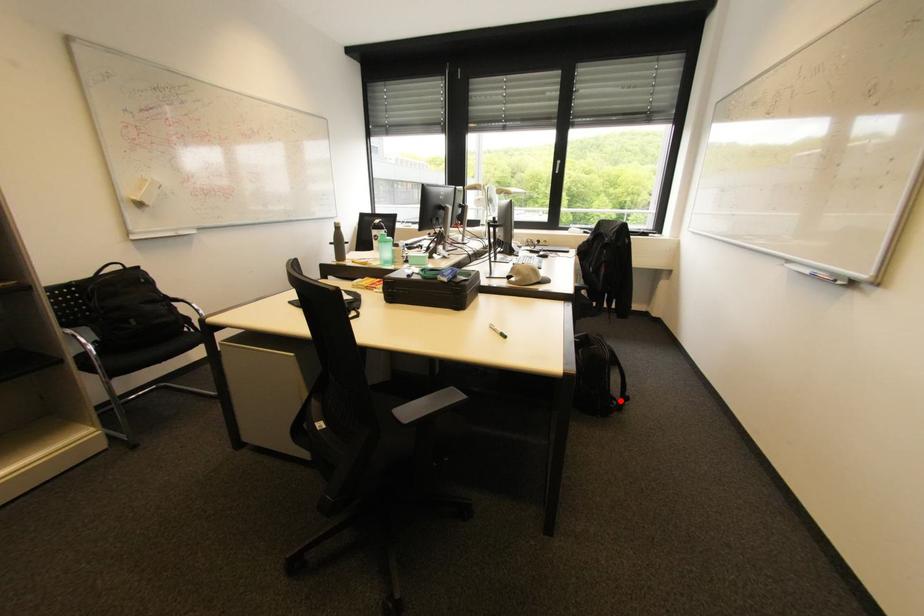
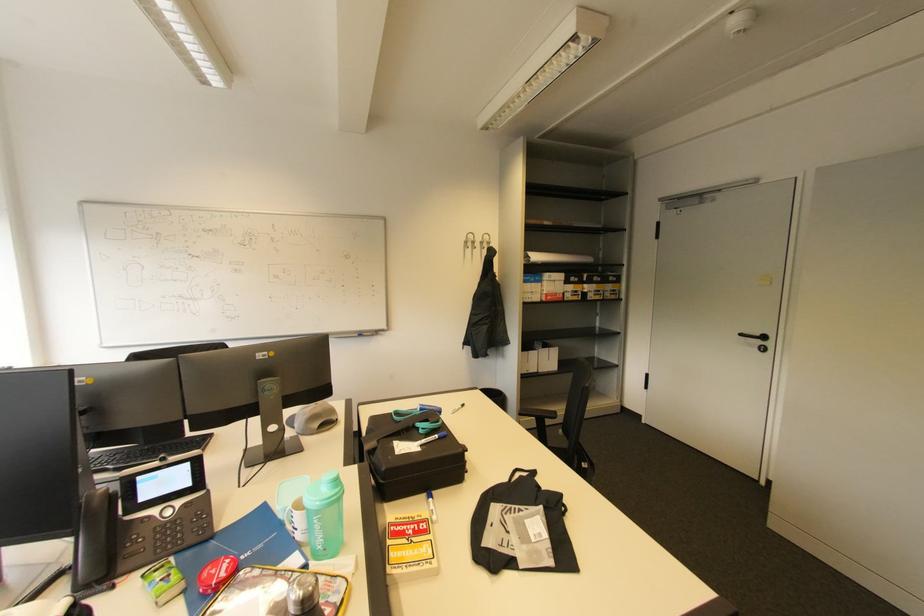
Question: I am providing you with two images of the same scene from different viewpoints. A red point is marked on the first image. At the location where the point appears in image 1, is it still visible in image 2?

Choices:
 (A) Yes
 (B) No

Answer: (B)